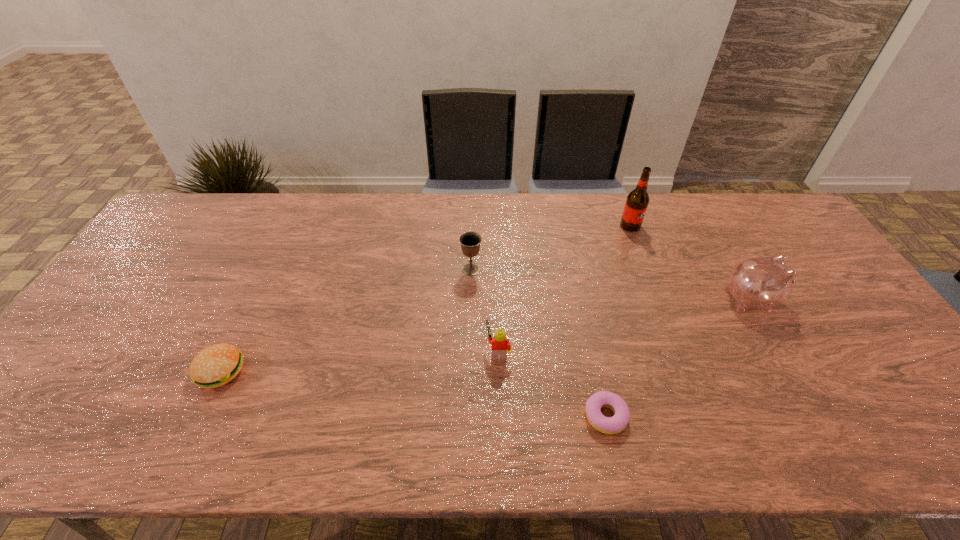
This screenshot has width=960, height=540. I want to click on object that is at the far edge, so click(x=637, y=201).

Where is `object that is at the near edge`? object that is at the near edge is located at coordinates (609, 425).

Locate an element on the screen. vacant space at the far edge of the desktop is located at coordinates (405, 212).

Locate an element on the screen. The height and width of the screenshot is (540, 960). vacant space at the near edge is located at coordinates (226, 426).

Locate an element on the screen. The image size is (960, 540). free location at the left edge of the desktop is located at coordinates (64, 418).

In the image, there is a desktop. Where is `free space at the right edge`? This screenshot has width=960, height=540. free space at the right edge is located at coordinates (848, 373).

The image size is (960, 540). What are the coordinates of `blank space at the far left corner of the desktop` in the screenshot? It's located at (217, 213).

The image size is (960, 540). Find the location of `free location at the near left corner of the desktop`. free location at the near left corner of the desktop is located at coordinates (34, 427).

In order to click on vacant space at the far right corner of the desktop in this screenshot , I will do `click(768, 201)`.

At what (x,y) coordinates should I click in order to perform the action: click on empty location between the patty and the piggy bank. Please return your answer as a coordinate pair (x, y). Image resolution: width=960 pixels, height=540 pixels. Looking at the image, I should click on (486, 335).